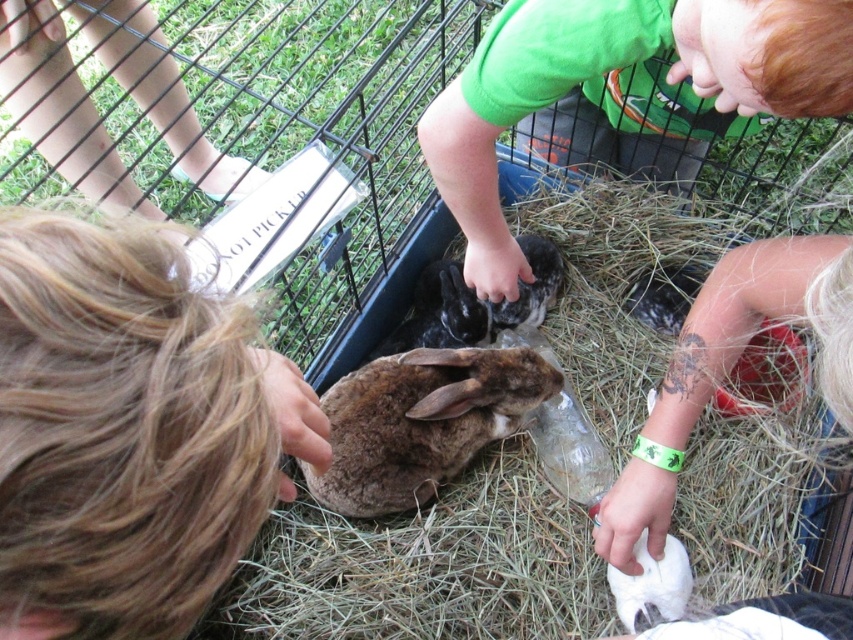
Question: Among these objects, which one is nearest to the camera?

Choices:
 (A) white soft fur at lower center
 (B) brown fuzzy rabbit at center
 (C) brown soft hay at center
 (D) soft gray fur rabbit at center

Answer: (C)

Question: Which point is farther to the camera?

Choices:
 (A) brown fuzzy rabbit at center
 (B) green cotton shirt at upper center
 (C) white soft fur at lower center

Answer: (A)

Question: Can you confirm if brown soft hay at center is positioned below green cotton shirt at upper center?

Choices:
 (A) no
 (B) yes

Answer: (B)

Question: Can you confirm if green cotton shirt at upper center is positioned above soft gray fur rabbit at center?

Choices:
 (A) no
 (B) yes

Answer: (B)

Question: From the image, what is the correct spatial relationship of brown fuzzy rabbit at center in relation to soft gray fur rabbit at center?

Choices:
 (A) right
 (B) left

Answer: (B)

Question: Which point is closer to the camera?

Choices:
 (A) white soft fur at lower center
 (B) soft gray fur rabbit at center

Answer: (A)